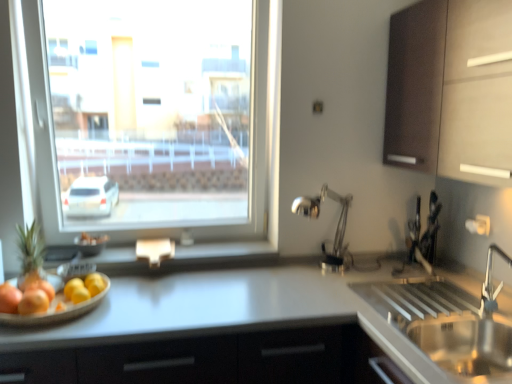
Question: Is the position of green matte pineapple at left more distant than that of metallic silver window sill at center?

Choices:
 (A) no
 (B) yes

Answer: (A)

Question: Can you confirm if green matte pineapple at left is shorter than metallic silver window sill at center?

Choices:
 (A) no
 (B) yes

Answer: (A)

Question: From a real-world perspective, does green matte pineapple at left stand above metallic silver window sill at center?

Choices:
 (A) no
 (B) yes

Answer: (B)

Question: Is green matte pineapple at left in front of metallic silver window sill at center?

Choices:
 (A) yes
 (B) no

Answer: (A)

Question: From the image's perspective, is green matte pineapple at left on metallic silver window sill at center?

Choices:
 (A) no
 (B) yes

Answer: (B)

Question: Considering the relative sizes of green matte pineapple at left and metallic silver window sill at center in the image provided, is green matte pineapple at left wider than metallic silver window sill at center?

Choices:
 (A) yes
 (B) no

Answer: (B)

Question: Considering the relative positions of satin nickel sink at lower right and dark wood cabinet at upper right in the image provided, is satin nickel sink at lower right to the left of dark wood cabinet at upper right from the viewer's perspective?

Choices:
 (A) yes
 (B) no

Answer: (A)

Question: From the image's perspective, is satin nickel sink at lower right over dark wood cabinet at upper right?

Choices:
 (A) no
 (B) yes

Answer: (A)

Question: Does satin nickel sink at lower right come in front of dark wood cabinet at upper right?

Choices:
 (A) no
 (B) yes

Answer: (B)

Question: Does satin nickel sink at lower right contain dark wood cabinet at upper right?

Choices:
 (A) no
 (B) yes

Answer: (A)

Question: Does satin nickel sink at lower right have a lesser width compared to dark wood cabinet at upper right?

Choices:
 (A) no
 (B) yes

Answer: (A)

Question: Considering the relative sizes of satin nickel sink at lower right and dark wood cabinet at upper right in the image provided, is satin nickel sink at lower right wider than dark wood cabinet at upper right?

Choices:
 (A) yes
 (B) no

Answer: (A)

Question: Does yellow matte lemon at lower left, the 1th fruit positioned from the right, have a lesser width compared to transparent glass window at upper left?

Choices:
 (A) yes
 (B) no

Answer: (A)